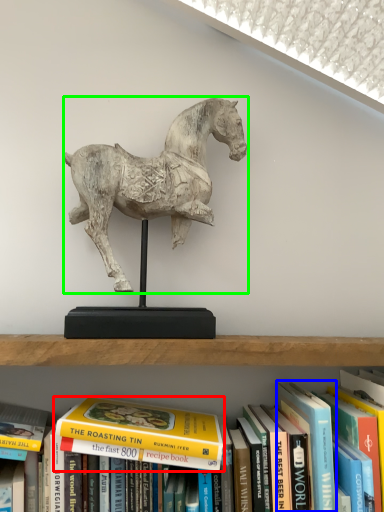
Question: Which object is positioned closest to book (highlighted by a red box)? Select from paperback book (highlighted by a blue box) and horse (highlighted by a green box).

Choices:
 (A) paperback book
 (B) horse

Answer: (A)